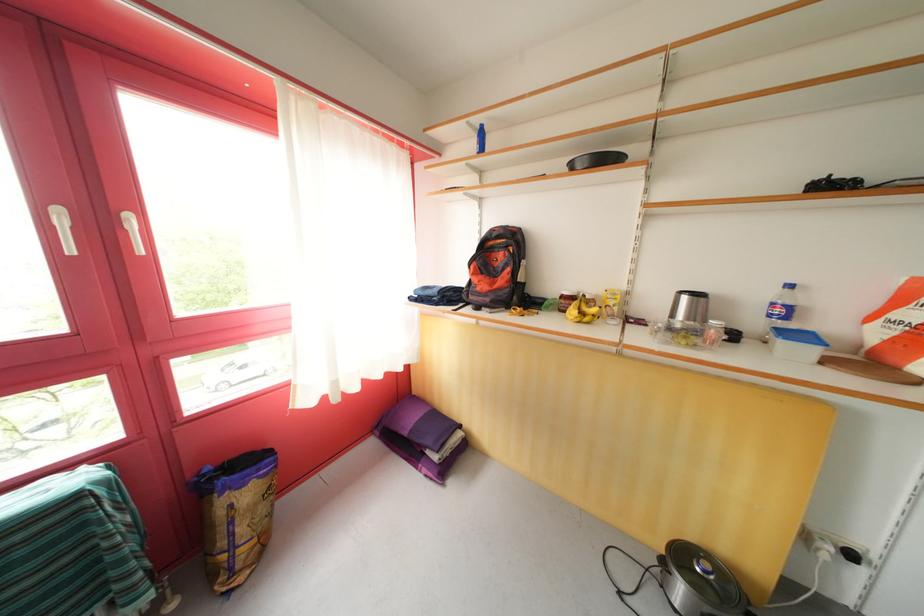
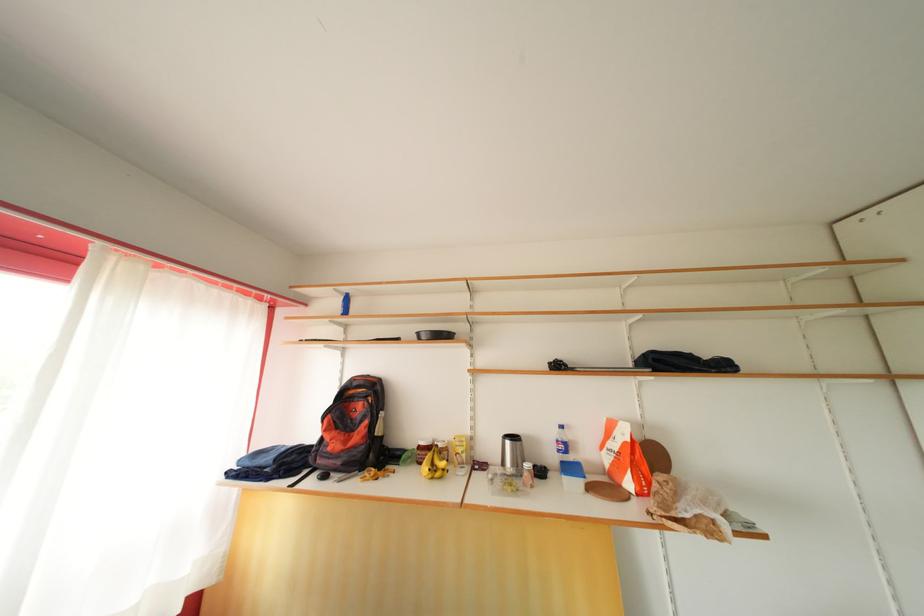
In the second image, find the point that corresponds to pixel 694 344 in the first image.

(517, 490)